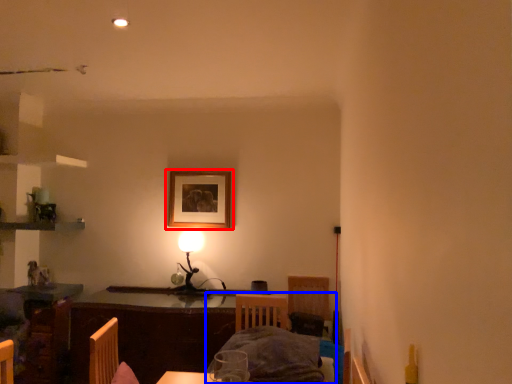
Question: Which of the following is the farthest to the observer, picture frame (highlighted by a red box) or bed (highlighted by a blue box)?

Choices:
 (A) picture frame
 (B) bed

Answer: (A)